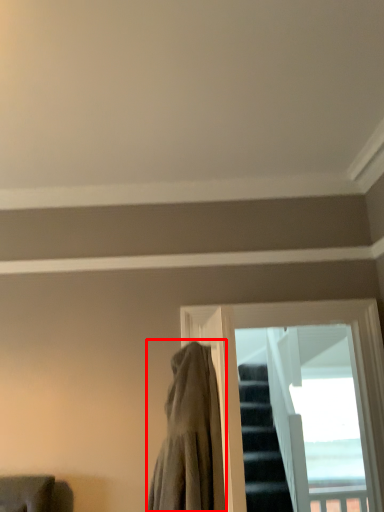
Question: Observing the image, what is the correct spatial positioning of cloak (annotated by the red box) in reference to window?

Choices:
 (A) right
 (B) left

Answer: (B)